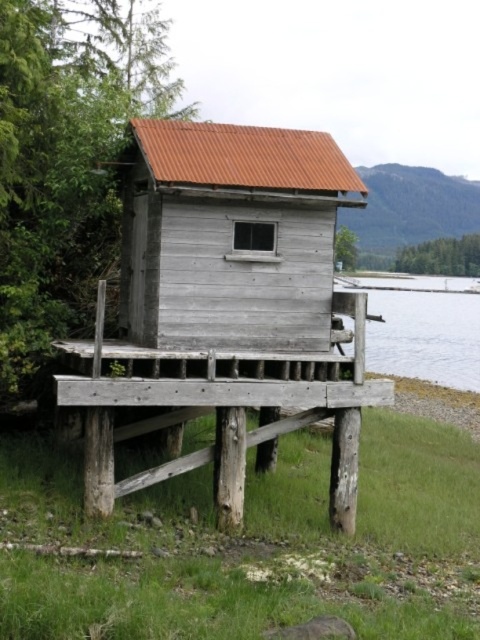
Question: Which of these objects is positioned farthest from the weathered wood cabin at center?

Choices:
 (A) clear water at lower right
 (B) weathered wood hut at center

Answer: (A)

Question: In this image, where is weathered wood hut at center located relative to weathered wood cabin at center?

Choices:
 (A) left
 (B) right

Answer: (B)

Question: Estimate the real-world distances between objects in this image. Which object is farther from the weathered wood cabin at center?

Choices:
 (A) clear water at lower right
 (B) weathered wood hut at center

Answer: (A)

Question: Does weathered wood cabin at center appear on the left side of clear water at lower right?

Choices:
 (A) no
 (B) yes

Answer: (B)

Question: Which point is closer to the camera?

Choices:
 (A) clear water at lower right
 (B) weathered wood cabin at center
 (C) weathered wood hut at center

Answer: (C)

Question: Can you confirm if weathered wood hut at center is wider than clear water at lower right?

Choices:
 (A) yes
 (B) no

Answer: (B)